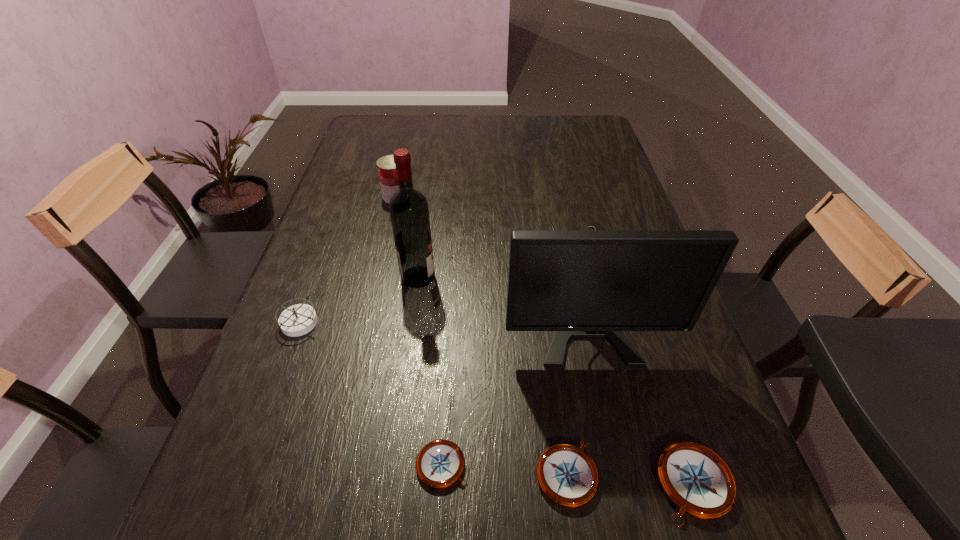
Find the location of a particular element. This screenshot has width=960, height=540. compass that is the closest to the alcohol is located at coordinates (297, 320).

I want to click on blank area in the image that satisfies the following two spatial constraints: 1. on the front side of the fifth tallest object; 2. on the left side of the second compass from right to left, so click(567, 483).

At what (x,y) coordinates should I click in order to perform the action: click on blank space that satisfies the following two spatial constraints: 1. on the front side of the second compass from right to left; 2. on the left side of the third shortest object. Please return your answer as a coordinate pair (x, y). This screenshot has width=960, height=540. Looking at the image, I should click on (567, 483).

The image size is (960, 540). I want to click on vacant region that satisfies the following two spatial constraints: 1. on the front label of the second compass from left to right; 2. on the left side of the fifth shortest object, so click(x=333, y=465).

This screenshot has height=540, width=960. I want to click on free spot that satisfies the following two spatial constraints: 1. on the front and back of the alcohol; 2. on the left side of the third shortest object, so click(389, 483).

I want to click on vacant point that satisfies the following two spatial constraints: 1. on the back side of the shortest compass; 2. on the front label of the can, so pos(458,197).

The image size is (960, 540). What are the coordinates of `free space that satisfies the following two spatial constraints: 1. on the front label of the sixth tallest object; 2. on the left side of the fifth shortest object` in the screenshot? It's located at (331, 474).

At what (x,y) coordinates should I click in order to perform the action: click on free space that satisfies the following two spatial constraints: 1. on the front and back of the alcohol; 2. on the front side of the leftmost compass. Please return your answer as a coordinate pair (x, y). The image size is (960, 540). Looking at the image, I should click on (x=412, y=323).

Locate an element on the screen. free space that satisfies the following two spatial constraints: 1. on the front label of the can; 2. on the right side of the rightmost compass is located at coordinates (328, 483).

Locate an element on the screen. vacant space that satisfies the following two spatial constraints: 1. on the front and back of the alcohol; 2. on the front side of the leftmost compass is located at coordinates (412, 323).